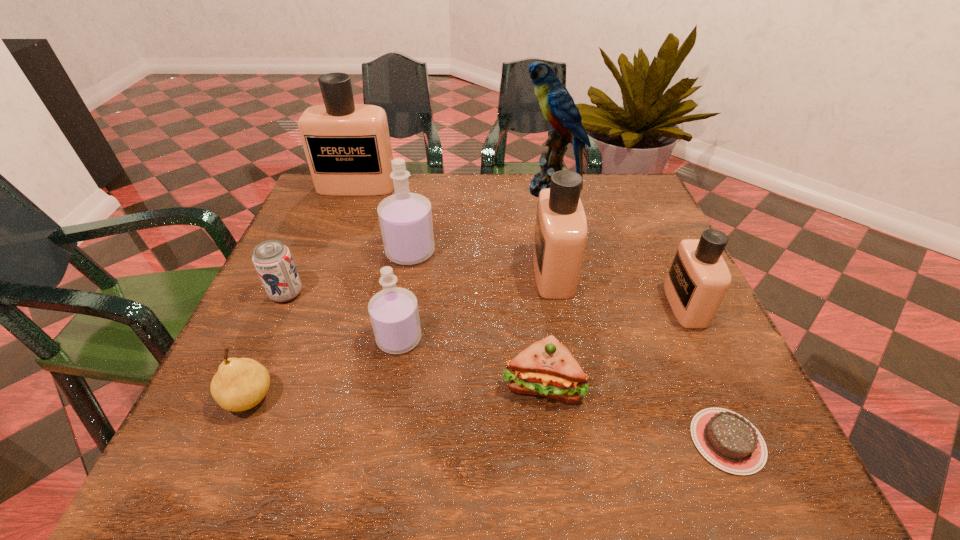
I want to click on pear, so click(x=240, y=384).

Locate an element on the screen. sandwich is located at coordinates (546, 368).

The height and width of the screenshot is (540, 960). Find the location of `brown chocolate cake`. brown chocolate cake is located at coordinates (726, 439).

At what (x,y) coordinates should I click in order to perform the action: click on the shortest object. Please return your answer as a coordinate pair (x, y). The width and height of the screenshot is (960, 540). Looking at the image, I should click on (726, 439).

This screenshot has width=960, height=540. What are the coordinates of `free space located on the face of the parrot` in the screenshot? It's located at (503, 190).

In order to click on blank space located 0.210m on the face of the parrot in this screenshot , I will do `click(446, 190)`.

This screenshot has height=540, width=960. I want to click on free region located 0.100m on the face of the parrot, so click(x=486, y=190).

Where is `vacant area situated 0.130m on the front label of the leftmost perfume`? Image resolution: width=960 pixels, height=540 pixels. vacant area situated 0.130m on the front label of the leftmost perfume is located at coordinates (342, 225).

At what (x,y) coordinates should I click in order to perform the action: click on free space located 0.300m on the front label of the second smallest beige perfume. Please return your answer as a coordinate pair (x, y). Looking at the image, I should click on (400, 272).

The height and width of the screenshot is (540, 960). I want to click on free location located on the front label of the second smallest beige perfume, so click(427, 272).